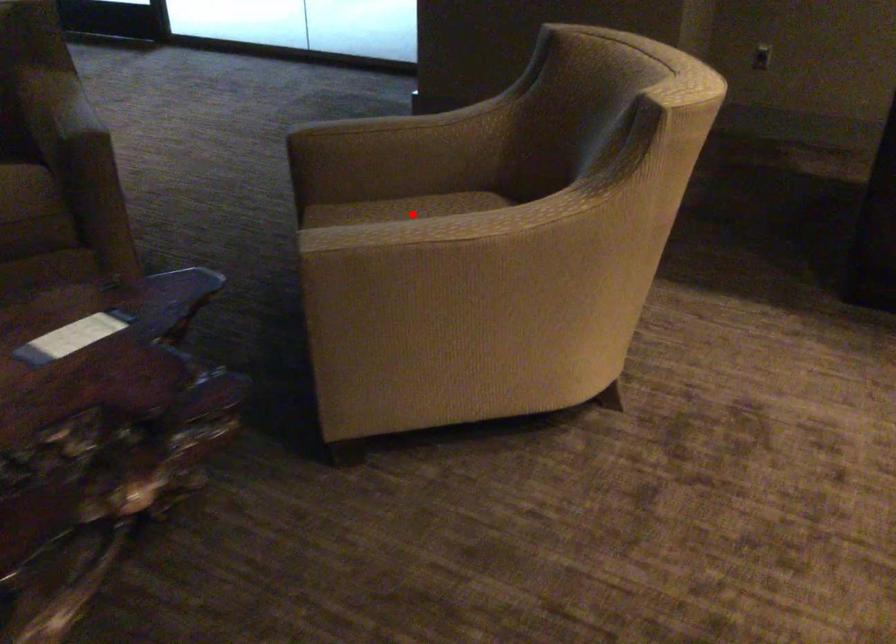
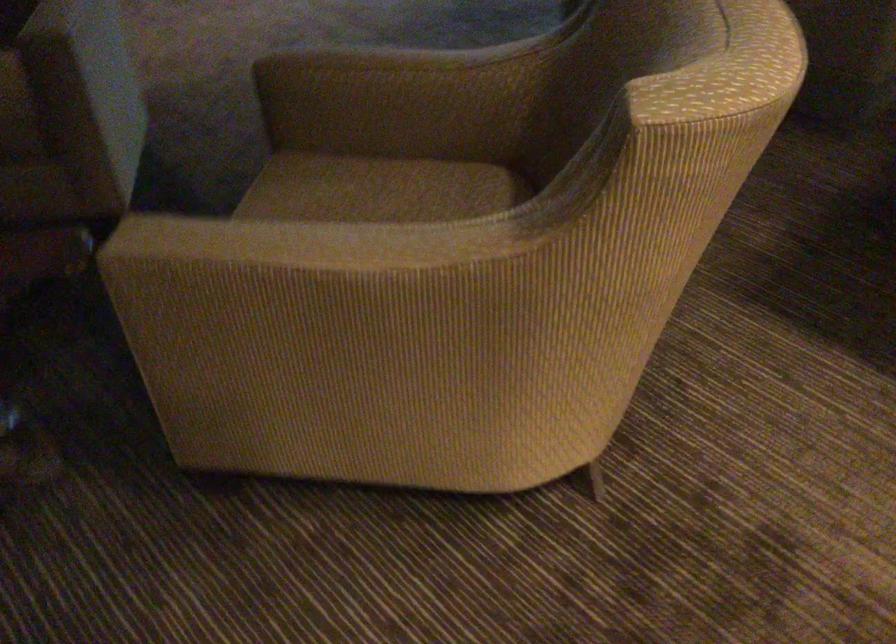
The point at the highlighted location is marked in the first image. Where is the corresponding point in the second image?

(380, 187)